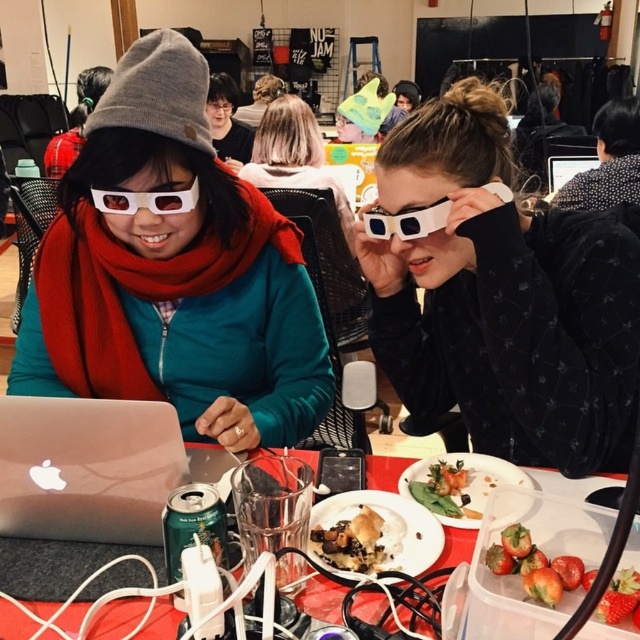
Does point (448, 208) come closer to viewer compared to point (564, 157)?

Yes.

Is point (392, 228) farther from camera compared to point (586, 161)?

No, it is in front of (586, 161).

In order to click on blue plastic goggles at center in this screenshot , I will do `click(406, 221)`.

Which of these two, white glossy paper glasses at center or shiny golden plate at center, stands shorter?

shiny golden plate at center

Measure the distance from white glossy paper glasses at center to shiny golden plate at center.

white glossy paper glasses at center and shiny golden plate at center are 11.33 inches apart from each other.

Identify the location of white glossy paper glasses at center. The height and width of the screenshot is (640, 640). (502, 298).

This screenshot has height=640, width=640. I want to click on white glossy paper glasses at center, so click(x=502, y=298).

Who is positioned more to the left, matte black glasses at upper center or silver metallic laptop at upper center?

Positioned to the left is matte black glasses at upper center.

Is matte black glasses at upper center positioned before silver metallic laptop at upper center?

Yes.

Image resolution: width=640 pixels, height=640 pixels. Find the location of `matte black glasses at upper center`. matte black glasses at upper center is located at coordinates (227, 122).

Where is `matte black glasses at upper center`? matte black glasses at upper center is located at coordinates (227, 122).